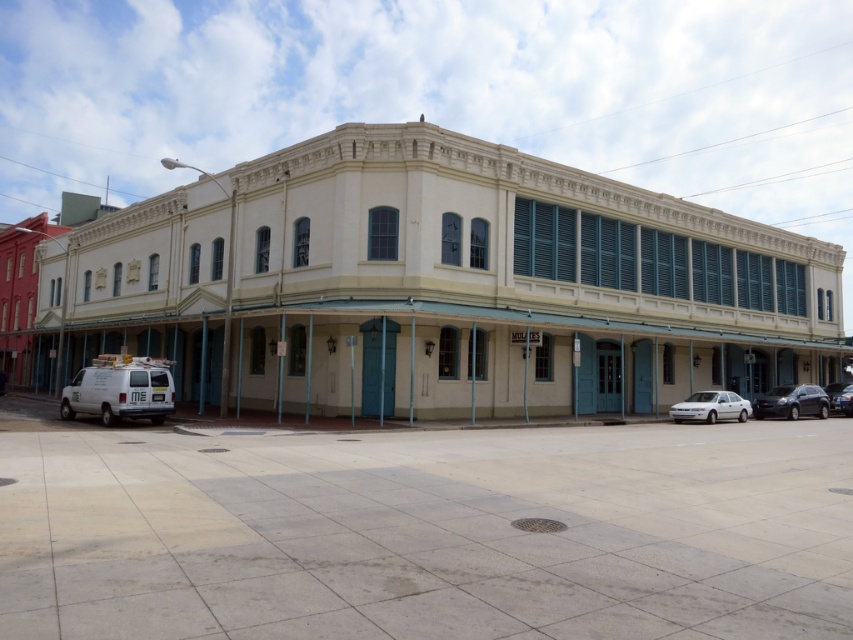
Which is above, matte white building at center or black matte car at lower right?

matte white building at center

Is matte white building at center taller than black matte car at lower right?

Indeed, matte white building at center has a greater height compared to black matte car at lower right.

You are a GUI agent. You are given a task and a screenshot of the screen. Output one action in this format:
    pyautogui.click(x=<x>, y=<y>)
    Task: Click on the matte white building at center
    Image resolution: width=853 pixels, height=640 pixels.
    Given the screenshot: What is the action you would take?
    coord(436,285)

Which is behind, point (640, 272) or point (840, 406)?

Point (840, 406)

Does matte white building at center have a larger size compared to shiny black car at lower right?

Yes, matte white building at center is bigger than shiny black car at lower right.

Between point (495, 284) and point (851, 387), which one is positioned in front?

Point (495, 284) is in front.

Locate an element on the screen. matte white building at center is located at coordinates (436, 285).

Measure the distance between matte white building at center and camera.

A distance of 71.05 feet exists between matte white building at center and camera.

You are a GUI agent. You are given a task and a screenshot of the screen. Output one action in this format:
    pyautogui.click(x=<x>, y=<y>)
    Task: Click on the matte white building at center
    
    Given the screenshot: What is the action you would take?
    point(436,285)